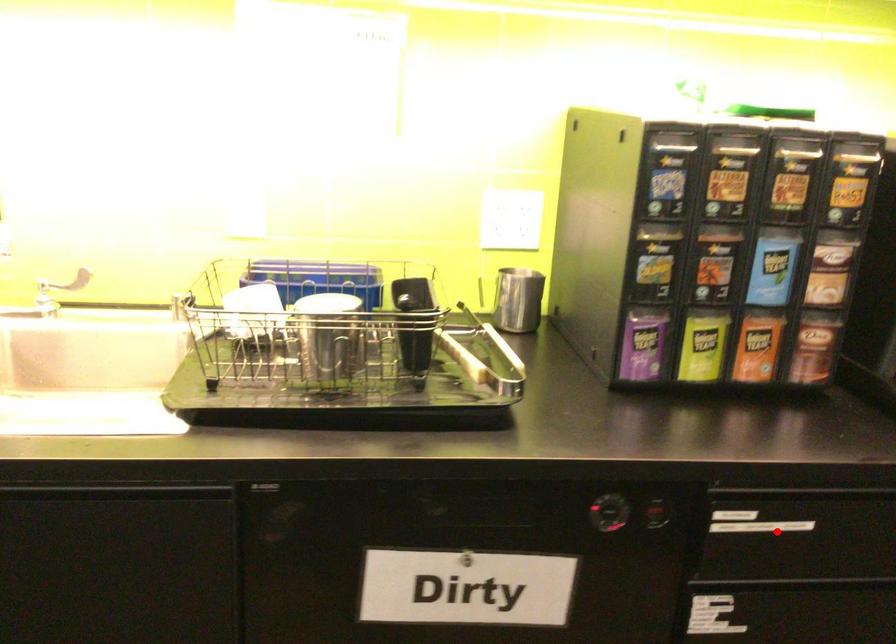
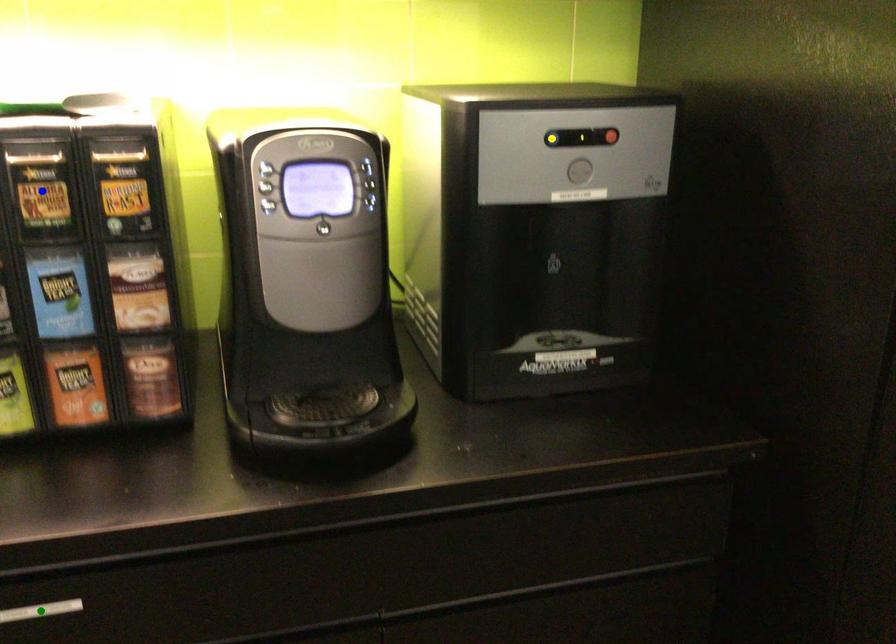
Question: I am providing you with two images of the same scene from different viewpoints. A red point is marked on the first image. You are given multiple points on the second image. Which point in image 2 represents the same 3d spot as the red point in image 1?

Choices:
 (A) blue point
 (B) yellow point
 (C) green point

Answer: (C)